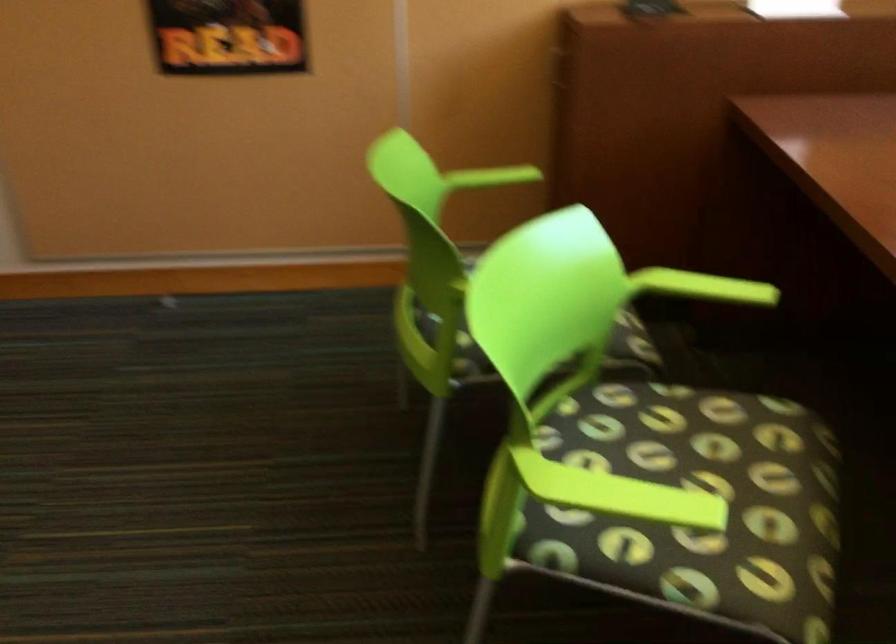
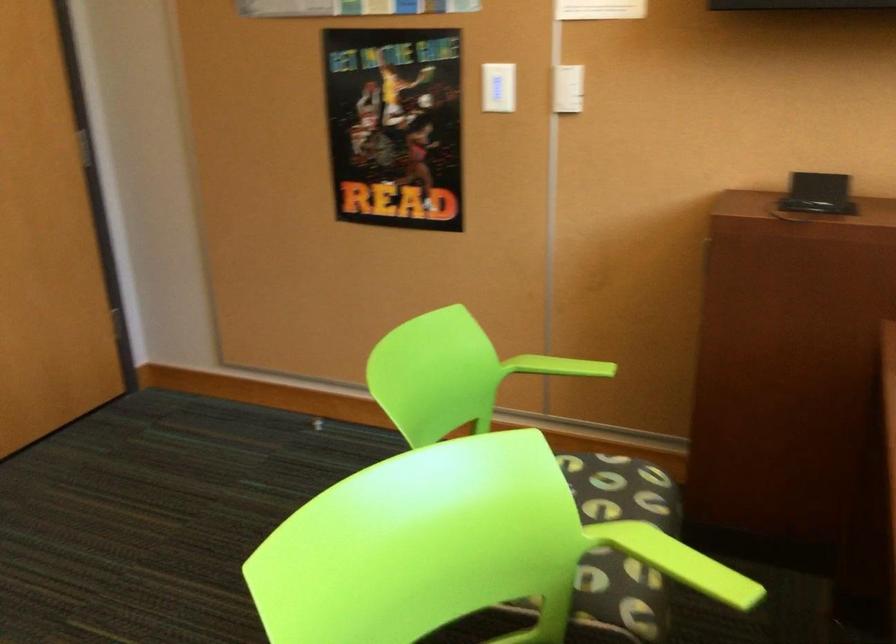
Find the pixel in the second image that matches point (711, 290) in the first image.

(685, 564)